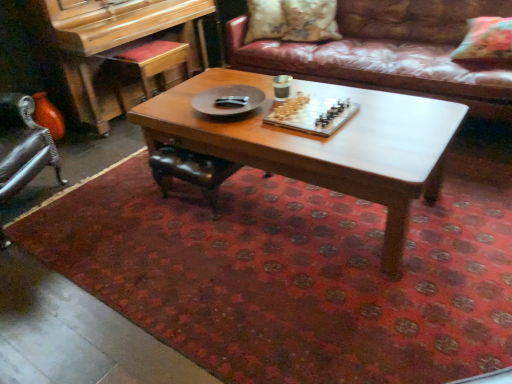
Looking at this image, measure the distance between point (306, 101) and camera.

Point (306, 101) and camera are 2.19 meters apart from each other.

Describe the element at coordinates (124, 49) in the screenshot. I see `wooden piano at left` at that location.

Image resolution: width=512 pixels, height=384 pixels. What are the coordinates of `translucent glass chessboard at center` in the screenshot? It's located at (313, 114).

From a real-world perspective, which object rests below the other?

wooden chessboard at center, from a real-world perspective.

Is wooden chessboard at center facing away from floral fabric pillow at upper center, which is counted as the first pillow, starting from the left?

Yes, wooden chessboard at center is facing away from floral fabric pillow at upper center, which is counted as the first pillow, starting from the left.

From the picture: How different are the orientations of wooden chessboard at center and floral fabric pillow at upper center, placed as the 1th pillow when sorted from back to front, in degrees?

The facing directions of wooden chessboard at center and floral fabric pillow at upper center, placed as the 1th pillow when sorted from back to front, are 44.4 degrees apart.

Between point (270, 100) and point (283, 19), which one is positioned behind?

Positioned behind is point (283, 19).

Is floral fabric pillow at upper right, which ranks as the first pillow in front-to-back order, at the back of wooden piano at left?

No, floral fabric pillow at upper right, which ranks as the first pillow in front-to-back order, is not at the back of wooden piano at left.

Considering the sizes of objects wooden piano at left and floral fabric pillow at upper right, which is the third pillow in back-to-front order, in the image provided, who is thinner, wooden piano at left or floral fabric pillow at upper right, which is the third pillow in back-to-front order,?

Thinner between the two is floral fabric pillow at upper right, which is the third pillow in back-to-front order.

Is wooden piano at left beside floral fabric pillow at upper right, which ranks as the first pillow in front-to-back order?

No.

Can you tell me how much brown leather couch at upper center and translucent glass chessboard at center differ in facing direction?

The angular difference between brown leather couch at upper center and translucent glass chessboard at center is 0.0279 degrees.

Is brown leather couch at upper center oriented towards translucent glass chessboard at center?

Yes, brown leather couch at upper center is facing translucent glass chessboard at center.

Looking at this image, from a real-world perspective, which object stands above the other?

In real-world perspective, translucent glass chessboard at center is above.

Consider the image. Is brown leather couch at upper center next to translucent glass chessboard at center?

Answer: No, brown leather couch at upper center is not next to translucent glass chessboard at center.

From a real-world perspective, which is physically below, floral fabric pillow at upper center, placed as the 1th pillow when sorted from back to front, or translucent glass chessboard at center?

translucent glass chessboard at center, from a real-world perspective.

Does floral fabric pillow at upper center, which is counted as the first pillow, starting from the left, have a larger size compared to translucent glass chessboard at center?

Yes, floral fabric pillow at upper center, which is counted as the first pillow, starting from the left, is bigger than translucent glass chessboard at center.

Does floral fabric pillow at upper center, arranged as the third pillow when viewed from the right, have a greater width compared to translucent glass chessboard at center?

No.

Which of these two, floral fabric pillow at upper center, which is counted as the first pillow, starting from the left, or translucent glass chessboard at center, stands taller?

Standing taller between the two is floral fabric pillow at upper center, which is counted as the first pillow, starting from the left.

Can you confirm if wooden piano at left is bigger than wooden chessboard at center?

Yes, wooden piano at left is bigger than wooden chessboard at center.

Does wooden piano at left have a lesser width compared to wooden chessboard at center?

Indeed, wooden piano at left has a lesser width compared to wooden chessboard at center.

Choose the correct answer: Is wooden piano at left inside wooden chessboard at center or outside it?

wooden piano at left lies outside wooden chessboard at center.

Consider the image. From the image's perspective, is wooden piano at left above wooden chessboard at center?

Yes, from the image's perspective, wooden piano at left is on top of wooden chessboard at center.

Relative to floral fabric pillow at upper right, arranged as the third pillow when viewed from the left, is fluffy beige pillow at upper center, which appears as the second pillow when viewed from the right, in front or behind?

Clearly, fluffy beige pillow at upper center, which appears as the second pillow when viewed from the right, is behind floral fabric pillow at upper right, arranged as the third pillow when viewed from the left.

Is there a large distance between fluffy beige pillow at upper center, arranged as the second pillow when viewed from the back, and floral fabric pillow at upper right, which ranks as the first pillow in front-to-back order?

fluffy beige pillow at upper center, arranged as the second pillow when viewed from the back, is positioned a significant distance from floral fabric pillow at upper right, which ranks as the first pillow in front-to-back order.

Identify the location of pillow that is the 2nd one above the floral fabric pillow at upper right, arranged as the third pillow when viewed from the left (from a real-world perspective). [310, 20].

Measure the distance from fluffy beige pillow at upper center, which appears as the 2th pillow when viewed from the front, to floral fabric pillow at upper right, which ranks as the first pillow in front-to-back order.

The distance of fluffy beige pillow at upper center, which appears as the 2th pillow when viewed from the front, from floral fabric pillow at upper right, which ranks as the first pillow in front-to-back order, is 3.76 feet.

From the picture: Can you confirm if floral fabric pillow at upper right, which ranks as the first pillow in front-to-back order, is smaller than wooden piano at left?

Yes.

Locate an element on the screen. This screenshot has height=384, width=512. piano on the left of floral fabric pillow at upper right, which is the third pillow in back-to-front order is located at coordinates (124, 49).

From the image's perspective, is floral fabric pillow at upper right, acting as the 1th pillow starting from the right, under wooden piano at left?

Indeed, from the image's perspective, floral fabric pillow at upper right, acting as the 1th pillow starting from the right, is shown beneath wooden piano at left.

There is a wooden chessboard at center. Where is `the 2nd pillow above it (from a real-world perspective)`? This screenshot has height=384, width=512. the 2nd pillow above it (from a real-world perspective) is located at coordinates (265, 20).

The height and width of the screenshot is (384, 512). Find the location of `piano located above the floral fabric pillow at upper right, which ranks as the first pillow in front-to-back order (from the image's perspective)`. piano located above the floral fabric pillow at upper right, which ranks as the first pillow in front-to-back order (from the image's perspective) is located at coordinates (124, 49).

Looking at the image, which one is located closer to floral fabric pillow at upper center, placed as the 1th pillow when sorted from back to front, translucent glass chessboard at center or floral fabric pillow at upper right, which ranks as the first pillow in front-to-back order?

Among the two, floral fabric pillow at upper right, which ranks as the first pillow in front-to-back order, is located nearer to floral fabric pillow at upper center, placed as the 1th pillow when sorted from back to front.

From the image, which object appears to be nearer to translucent glass chessboard at center, fluffy beige pillow at upper center, which appears as the second pillow when viewed from the left, or floral fabric pillow at upper center, arranged as the third pillow when viewed from the right?

The object closer to translucent glass chessboard at center is fluffy beige pillow at upper center, which appears as the second pillow when viewed from the left.

Looking at the image, which one is located further to wooden chessboard at center, brown leather couch at upper center or translucent glass chessboard at center?

brown leather couch at upper center lies further to wooden chessboard at center than the other object.

Looking at the image, which one is located closer to wooden piano at left, wooden chessboard at center or translucent glass chessboard at center?

Among the two, wooden chessboard at center is located nearer to wooden piano at left.

Considering their positions, is floral fabric pillow at upper center, placed as the 1th pillow when sorted from back to front, positioned closer to translucent glass chessboard at center than wooden piano at left?

floral fabric pillow at upper center, placed as the 1th pillow when sorted from back to front, is positioned closer to the anchor translucent glass chessboard at center.

Estimate the real-world distances between objects in this image. Which object is closer to brown leather couch at upper center, floral fabric pillow at upper right, acting as the 1th pillow starting from the right, or fluffy beige pillow at upper center, which appears as the second pillow when viewed from the left?

The object closer to brown leather couch at upper center is floral fabric pillow at upper right, acting as the 1th pillow starting from the right.

Looking at the image, which one is located further to fluffy beige pillow at upper center, which appears as the second pillow when viewed from the left, wooden piano at left or wooden chessboard at center?

Result: Based on the image, wooden chessboard at center appears to be further to fluffy beige pillow at upper center, which appears as the second pillow when viewed from the left.

Looking at the image, which one is located closer to brown leather couch at upper center, wooden piano at left or floral fabric pillow at upper center, the third pillow when ordered from front to back?

floral fabric pillow at upper center, the third pillow when ordered from front to back, lies closer to brown leather couch at upper center than the other object.

Find the location of `board game between wooden chessboard at center and floral fabric pillow at upper right, arranged as the third pillow when viewed from the left`. board game between wooden chessboard at center and floral fabric pillow at upper right, arranged as the third pillow when viewed from the left is located at coordinates (313, 114).

This screenshot has height=384, width=512. I want to click on board game between brown leather couch at upper center and wooden chessboard at center from top to bottom, so click(x=313, y=114).

The height and width of the screenshot is (384, 512). What are the coordinates of `board game between wooden chessboard at center and floral fabric pillow at upper center, the third pillow when ordered from front to back, along the z-axis` in the screenshot? It's located at (313, 114).

I want to click on board game situated between wooden piano at left and fluffy beige pillow at upper center, which appears as the second pillow when viewed from the left, from left to right, so click(x=313, y=114).